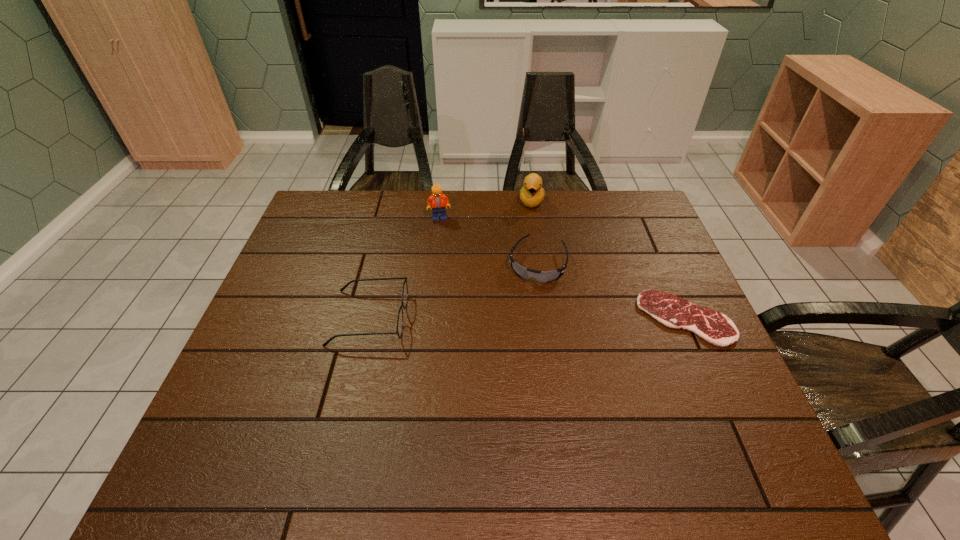
You are a GUI agent. You are given a task and a screenshot of the screen. Output one action in this format:
    pyautogui.click(x=<x>, y=<y>)
    Task: Click on the third tallest object
    The width and height of the screenshot is (960, 540).
    Given the screenshot: What is the action you would take?
    pyautogui.click(x=399, y=330)

In order to click on spectacles in this screenshot , I will do `click(399, 330)`.

Locate an element on the screen. Image resolution: width=960 pixels, height=540 pixels. the shortest object is located at coordinates (672, 311).

Where is `the rightmost object`? the rightmost object is located at coordinates (672, 311).

Find the location of a particular element. The width and height of the screenshot is (960, 540). Lego is located at coordinates (437, 201).

Locate an element on the screen. The image size is (960, 540). the fourth object from right to left is located at coordinates (437, 201).

Where is `the second shortest object`? This screenshot has width=960, height=540. the second shortest object is located at coordinates (541, 276).

This screenshot has width=960, height=540. Identify the location of sunglasses. (541, 276).

Locate an element on the screen. This screenshot has height=540, width=960. duckling is located at coordinates (532, 194).

The width and height of the screenshot is (960, 540). What are the coordinates of `vacant space situated 0.200m on the front-facing side of the spectacles` in the screenshot? It's located at (483, 318).